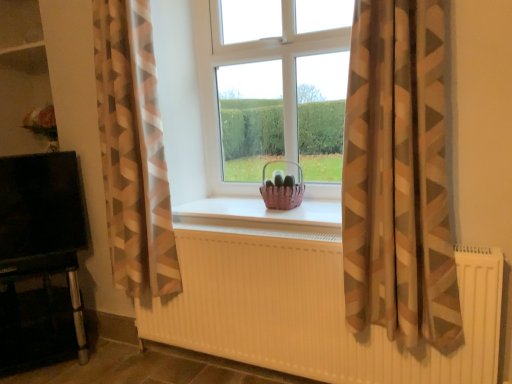
Question: Considering the relative sizes of pink woven basket at center and pink woven basket at center in the image provided, is pink woven basket at center bigger than pink woven basket at center?

Choices:
 (A) no
 (B) yes

Answer: (A)

Question: Is the position of pink woven basket at center more distant than that of pink woven basket at center?

Choices:
 (A) no
 (B) yes

Answer: (B)

Question: Can you confirm if pink woven basket at center is taller than pink woven basket at center?

Choices:
 (A) no
 (B) yes

Answer: (B)

Question: Is pink woven basket at center smaller than pink woven basket at center?

Choices:
 (A) yes
 (B) no

Answer: (A)

Question: Could pink woven basket at center be considered to be inside pink woven basket at center?

Choices:
 (A) yes
 (B) no

Answer: (B)

Question: Considering the relative sizes of pink woven basket at center and pink woven basket at center in the image provided, is pink woven basket at center thinner than pink woven basket at center?

Choices:
 (A) yes
 (B) no

Answer: (A)

Question: Is white ribbed radiator at center facing away from pink woven basket at center?

Choices:
 (A) yes
 (B) no

Answer: (B)

Question: Can you confirm if white ribbed radiator at center is smaller than pink woven basket at center?

Choices:
 (A) no
 (B) yes

Answer: (A)

Question: Is white ribbed radiator at center taller than pink woven basket at center?

Choices:
 (A) no
 (B) yes

Answer: (B)

Question: Does white ribbed radiator at center have a lesser height compared to pink woven basket at center?

Choices:
 (A) no
 (B) yes

Answer: (A)

Question: From the image's perspective, is white ribbed radiator at center over pink woven basket at center?

Choices:
 (A) no
 (B) yes

Answer: (A)

Question: Is white ribbed radiator at center aimed at pink woven basket at center?

Choices:
 (A) yes
 (B) no

Answer: (B)

Question: From the image's perspective, is brown sheer curtain at center, positioned as the first curtain in right-to-left order, over pink woven basket at center?

Choices:
 (A) no
 (B) yes

Answer: (B)